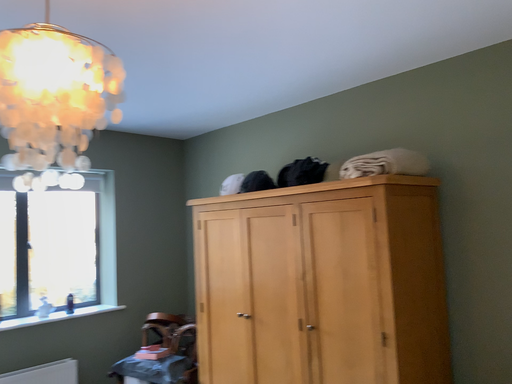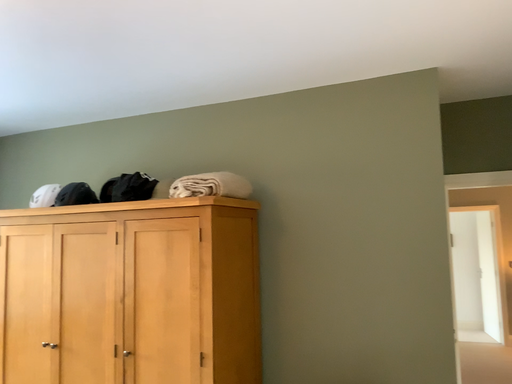
Question: Which way did the camera rotate in the video?

Choices:
 (A) rotated left
 (B) rotated right

Answer: (B)